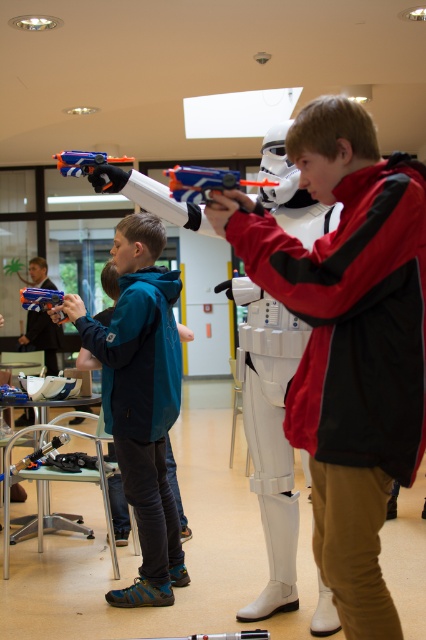
Who is shorter, teal fabric jacket at center or matte blue toy gun at center?

With less height is matte blue toy gun at center.

Image resolution: width=426 pixels, height=640 pixels. In order to click on teal fabric jacket at center in this screenshot , I will do `click(141, 397)`.

Where is `teal fabric jacket at center`? This screenshot has width=426, height=640. teal fabric jacket at center is located at coordinates (141, 397).

Is matte black jacket at center shorter than teal fabric jacket at center?

Indeed, matte black jacket at center has a lesser height compared to teal fabric jacket at center.

This screenshot has height=640, width=426. What do you see at coordinates (348, 340) in the screenshot? I see `matte black jacket at center` at bounding box center [348, 340].

Is point (327, 556) behind point (121, 467)?

No, it is in front of (121, 467).

Locate an element on the screen. The image size is (426, 640). matte black jacket at center is located at coordinates (348, 340).

Who is positioned more to the right, matte black jacket at center or matte blue toy gun at center?

From the viewer's perspective, matte black jacket at center appears more on the right side.

Who is taller, matte black jacket at center or matte blue toy gun at center?

Standing taller between the two is matte black jacket at center.

Between point (356, 550) and point (37, 288), which one is positioned behind?

Positioned behind is point (37, 288).

Identify the location of matte black jacket at center. The image size is (426, 640). (348, 340).